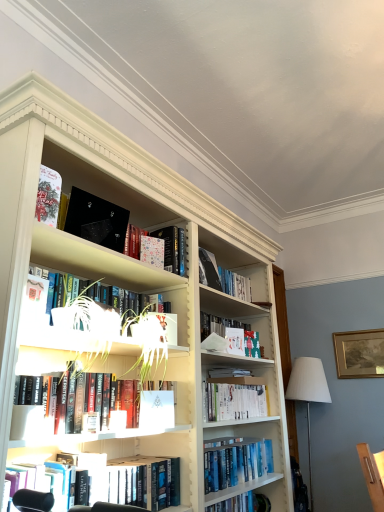
What do you see at coordinates (359, 353) in the screenshot? I see `gold-framed picture at upper right` at bounding box center [359, 353].

What is the approximate height of white fabric lampshade at right?

white fabric lampshade at right is 1.16 meters in height.

You are a GUI agent. You are given a task and a screenshot of the screen. Output one action in this format:
    pyautogui.click(x=<x>, y=<y>)
    Task: Click on the matte white book at center, the third paperback book in the top-to-bottom sequence
    
    Given the screenshot: What is the action you would take?
    pyautogui.click(x=235, y=340)

What do you see at coordinates (222, 277) in the screenshot? The height and width of the screenshot is (512, 384). I see `hardcover book at center, placed as the fifth book when sorted from bottom to top` at bounding box center [222, 277].

Measure the distance between hardcover book at center, placed as the fifth book when sorted from bottom to top, and camera.

The depth of hardcover book at center, placed as the fifth book when sorted from bottom to top, is 6.95 feet.

In order to face white matte paper at center, arranged as the third paperback book when viewed from the back, should I rotate leftwards or rightwards?

Rotate your view left by about 4.422°.

The height and width of the screenshot is (512, 384). What are the coordinates of `gold-framed picture at upper right` in the screenshot? It's located at [359, 353].

Can you confirm if hardcover book at lower center, which is counted as the 6th book, starting from the top, is taller than matte paper book at center, the second book when ordered from top to bottom?

Yes.

How many degrees apart are the facing directions of hardcover book at lower center, which is counted as the 6th book, starting from the top, and matte paper book at center, the 6th book ordered from the bottom?

The angular difference between hardcover book at lower center, which is counted as the 6th book, starting from the top, and matte paper book at center, the 6th book ordered from the bottom, is 3.2 degrees.

From the image's perspective, is hardcover book at lower center, which is counted as the 6th book, starting from the top, positioned above or below matte paper book at center, the second book when ordered from top to bottom?

Based on their image positions, hardcover book at lower center, which is counted as the 6th book, starting from the top, is located beneath matte paper book at center, the second book when ordered from top to bottom.

Between hardcover book at lower center, marked as the second book in a bottom-to-top arrangement, and matte paper book at center, the 6th book ordered from the bottom, which one has larger size?

hardcover book at lower center, marked as the second book in a bottom-to-top arrangement.

From a real-world perspective, count 2nd books upward from the hardcover book at center, the first book from the bottom, and point to it. Please provide its 2D coordinates.

[(234, 398)]

Looking at their sizes, would you say hardcover book at center, marked as the 3th book in a bottom-to-top arrangement, is wider or thinner than hardcover book at center, the seventh book from the top?

hardcover book at center, marked as the 3th book in a bottom-to-top arrangement, is wider than hardcover book at center, the seventh book from the top.

Can you tell me how much hardcover book at center, marked as the 3th book in a bottom-to-top arrangement, and hardcover book at center, the first book from the bottom, differ in facing direction?

2.34 degrees.

From the image's perspective, is hardcover book at center, which appears as the fifth book when viewed from the top, over hardcover book at center, the seventh book from the top?

Yes, from the image's perspective, hardcover book at center, which appears as the fifth book when viewed from the top, is above hardcover book at center, the seventh book from the top.

Between matte paper book at center, the second book when ordered from top to bottom, and gold-framed picture at upper right, which one has smaller width?

With smaller width is gold-framed picture at upper right.

How far apart are matte paper book at center, the 6th book ordered from the bottom, and gold-framed picture at upper right?

They are 2.12 meters apart.

At what (x,y) coordinates should I click in order to perform the action: click on the 4th book counting from the left of the gold-framed picture at upper right. Please return your answer as a coordinate pair (x, y). This screenshot has height=512, width=384. Looking at the image, I should click on (164, 246).

How different are the orientations of matte paper book at center, the second book when ordered from top to bottom, and gold-framed picture at upper right in degrees?

matte paper book at center, the second book when ordered from top to bottom, and gold-framed picture at upper right are facing 93.7 degrees away from each other.

Is hardcover book at center, placed as the fifth book when sorted from bottom to top, located within hardcover book at center, the seventh book from the top?

Definitely not — hardcover book at center, placed as the fifth book when sorted from bottom to top, is not inside hardcover book at center, the seventh book from the top.

Are hardcover book at center, the seventh book from the top, and hardcover book at center, which is counted as the 3th book, starting from the top, making contact?

No, hardcover book at center, the seventh book from the top, is not in contact with hardcover book at center, which is counted as the 3th book, starting from the top.

Who is shorter, hardcover book at center, the first book from the bottom, or hardcover book at center, placed as the fifth book when sorted from bottom to top?

With less height is hardcover book at center, the first book from the bottom.

Considering the relative sizes of hardcover book at center, the first book from the bottom, and hardcover book at center, which is counted as the 3th book, starting from the top, in the image provided, is hardcover book at center, the first book from the bottom, smaller than hardcover book at center, which is counted as the 3th book, starting from the top,?

No.

Is white matte paper at center, the first paperback book from the bottom, positioned with its back to hardcover book at center, the seventh book from the top?

No, white matte paper at center, the first paperback book from the bottom, is not facing the opposite direction of hardcover book at center, the seventh book from the top.

From the image's perspective, which one is positioned lower, white matte paper at center, the second paperback book from the right, or hardcover book at center, the seventh book from the top?

hardcover book at center, the seventh book from the top, is shown below in the image.

Which object is closer to the camera taking this photo, white matte paper at center, the first paperback book from the bottom, or hardcover book at center, the seventh book from the top?

white matte paper at center, the first paperback book from the bottom, is in front.

Considering the sizes of objects white matte paper at center, which is the 4th paperback book in top-to-bottom order, and hardcover book at center, the seventh book from the top, in the image provided, who is taller, white matte paper at center, which is the 4th paperback book in top-to-bottom order, or hardcover book at center, the seventh book from the top,?

Standing taller between the two is white matte paper at center, which is the 4th paperback book in top-to-bottom order.

You are a GUI agent. You are given a task and a screenshot of the screen. Output one action in this format:
    pyautogui.click(x=<x>, y=<y>)
    Task: Click on the picture frame that is above the hardcover book at lower center, marked as the second book in a bottom-to-top arrangement (from the image's perspective)
    Image resolution: width=384 pixels, height=512 pixels.
    Given the screenshot: What is the action you would take?
    pyautogui.click(x=359, y=353)

From the picture: Would you consider hardcover book at lower center, marked as the second book in a bottom-to-top arrangement, to be distant from gold-framed picture at upper right?

hardcover book at lower center, marked as the second book in a bottom-to-top arrangement, is positioned a significant distance from gold-framed picture at upper right.

Considering the relative sizes of hardcover book at lower center, which is counted as the 6th book, starting from the top, and gold-framed picture at upper right in the image provided, is hardcover book at lower center, which is counted as the 6th book, starting from the top, shorter than gold-framed picture at upper right?

Yes.

From a real-world perspective, count 1st books upward from the hardcover book at center, the seventh book from the top, and point to it. Please provide its 2D coordinates.

[(136, 481)]

Relative to hardcover book at center, the seventh book from the top, is hardcover book at lower center, marked as the second book in a bottom-to-top arrangement, in front or behind?

hardcover book at lower center, marked as the second book in a bottom-to-top arrangement, is positioned closer to the viewer than hardcover book at center, the seventh book from the top.

Measure the distance between hardcover book at lower center, marked as the second book in a bottom-to-top arrangement, and hardcover book at center, the seventh book from the top.

hardcover book at lower center, marked as the second book in a bottom-to-top arrangement, and hardcover book at center, the seventh book from the top, are 19.33 inches apart.

Are hardcover book at lower center, marked as the second book in a bottom-to-top arrangement, and hardcover book at center, the seventh book from the top, located far from each other?

Actually, hardcover book at lower center, marked as the second book in a bottom-to-top arrangement, and hardcover book at center, the seventh book from the top, are a little close together.

I want to click on the 4th book below when counting from the matte paper book at center, the second book when ordered from top to bottom (from the image's perspective), so click(136, 481).

Where is `the 2nd book above when counting from the hardcover book at center, the first book from the bottom (from the image's perspective)`? This screenshot has width=384, height=512. the 2nd book above when counting from the hardcover book at center, the first book from the bottom (from the image's perspective) is located at coordinates (234, 398).

From the picture: From the image, which object appears to be farther from hardcover book at center, which is counted as the 3th book, starting from the top, matte paper book at center, the 6th book ordered from the bottom, or green matte plant pot at upper left?

green matte plant pot at upper left is positioned further to the anchor hardcover book at center, which is counted as the 3th book, starting from the top.

Which object lies further to the anchor point hardcover book at center, placed as the fifth book when sorted from bottom to top, green matte plant pot at upper left or hardcover book at lower center, marked as the second book in a bottom-to-top arrangement?

hardcover book at lower center, marked as the second book in a bottom-to-top arrangement.

From the image, which object appears to be nearer to hardcover books at center, which is the 4th book from top to bottom, hardcover book at center, which is counted as the 3th book, starting from the top, or white matte paper at center, the second paperback book from the right?

white matte paper at center, the second paperback book from the right.

Which object lies nearer to the anchor point hardcover book at lower center, which is counted as the 6th book, starting from the top, hardcover book at center, which is counted as the 3th book, starting from the top, or matte paper book at center, the second book when ordered from top to bottom?

matte paper book at center, the second book when ordered from top to bottom, lies closer to hardcover book at lower center, which is counted as the 6th book, starting from the top, than the other object.

When comparing their distances from hardcover books at center, which is the 4th book from top to bottom, does green matte plant pot at upper left or white matte paper at center, the third paperback book positioned from the left, seem further?

Among the two, green matte plant pot at upper left is located further to hardcover books at center, which is the 4th book from top to bottom.

Looking at the image, which one is located further to hardcover book at lower center, marked as the second book in a bottom-to-top arrangement, hardcover book at center, which appears as the fifth book when viewed from the top, or patterned paper at upper center, the 3th paperback book viewed from the front?

Based on the image, patterned paper at upper center, the 3th paperback book viewed from the front, appears to be further to hardcover book at lower center, marked as the second book in a bottom-to-top arrangement.

Which object lies nearer to the anchor point white matte paper at center, the third paperback book positioned from the left, white fabric lampshade at right or patterned paper at upper center, arranged as the 3th paperback book when ordered from the bottom?

patterned paper at upper center, arranged as the 3th paperback book when ordered from the bottom, is closer to white matte paper at center, the third paperback book positioned from the left.

Considering their positions, is white fabric lampshade at right positioned further to hardcover book at center, the seventh book from the top, than hardcover book at center, which appears as the fifth book when viewed from the top?

white fabric lampshade at right is positioned further to the anchor hardcover book at center, the seventh book from the top.

Locate an element on the screen. table lamp between matte red book at upper left, which is counted as the first book, starting from the top, and hardcover book at center, the first book from the bottom, in the vertical direction is located at coordinates (308, 392).

In order to click on cabinet between matte paper book at center, the 6th book ordered from the bottom, and hardcover book at center, which appears as the fifth book when viewed from the top, in the vertical direction in this screenshot , I will do `click(97, 262)`.

This screenshot has width=384, height=512. I want to click on cabinet that lies between matte black book at upper left, which is the first paperback book in top-to-bottom order, and hardcover book at center, the first book from the bottom, from top to bottom, so click(x=97, y=262).

The image size is (384, 512). In order to click on table lamp between hardcover book at center, which is counted as the 3th book, starting from the top, and hardcover book at center, the first book from the bottom, in the vertical direction in this screenshot , I will do `click(308, 392)`.